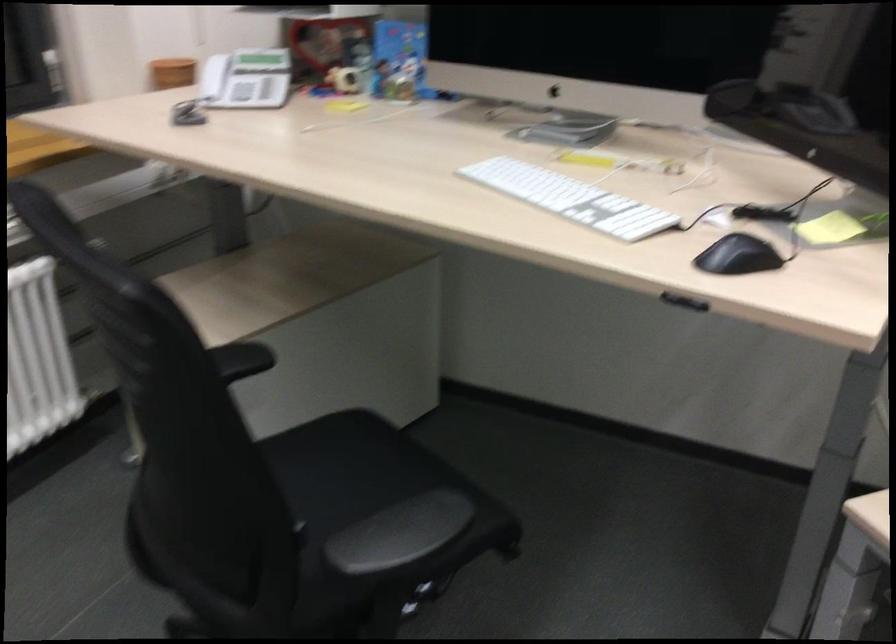
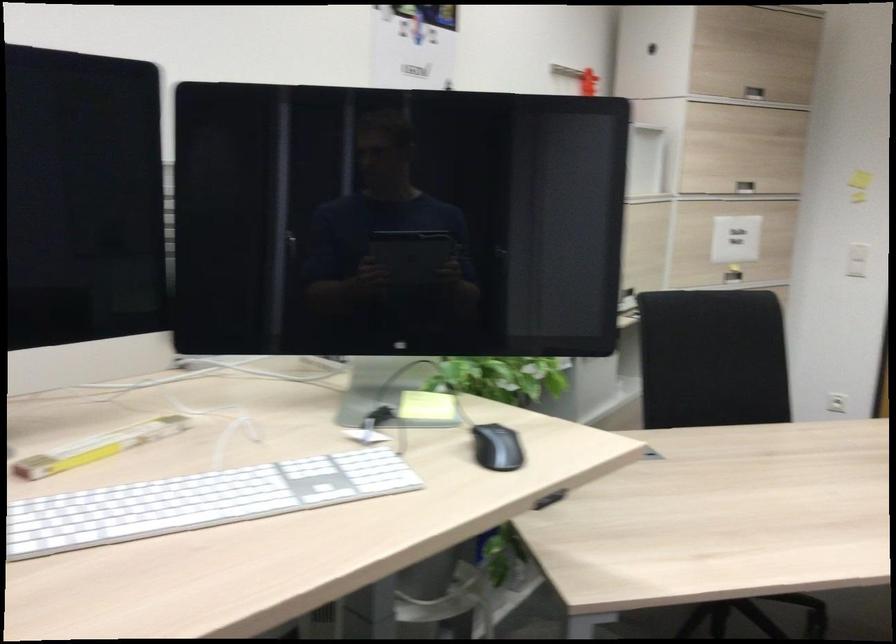
Where in the second image is the point corresponding to the point at 560,192 from the first image?

(200, 500)